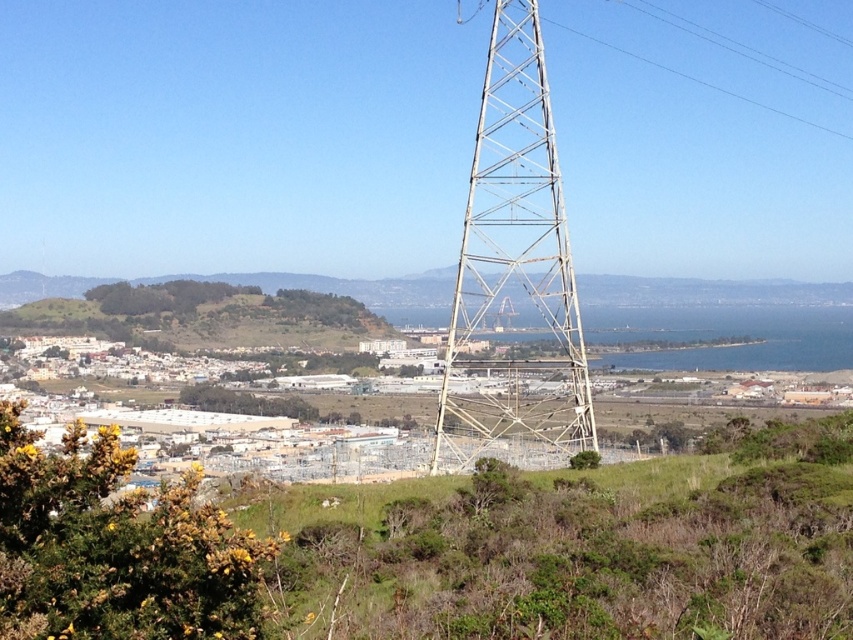
Is metallic structure at center below green grassy hillside at center?

No.

Image resolution: width=853 pixels, height=640 pixels. What do you see at coordinates (514, 273) in the screenshot?
I see `metallic structure at center` at bounding box center [514, 273].

The width and height of the screenshot is (853, 640). What do you see at coordinates (514, 273) in the screenshot?
I see `metallic structure at center` at bounding box center [514, 273].

Image resolution: width=853 pixels, height=640 pixels. I want to click on metallic structure at center, so click(514, 273).